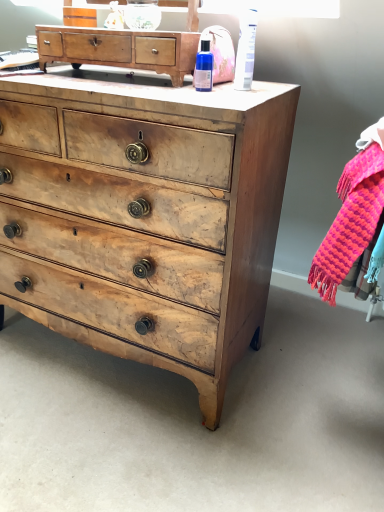
Identify the location of empty space that is to the right of wooden chest of drawers at center, the 1th chest of drawers when ordered from bottom to top. This screenshot has width=384, height=512. (315, 370).